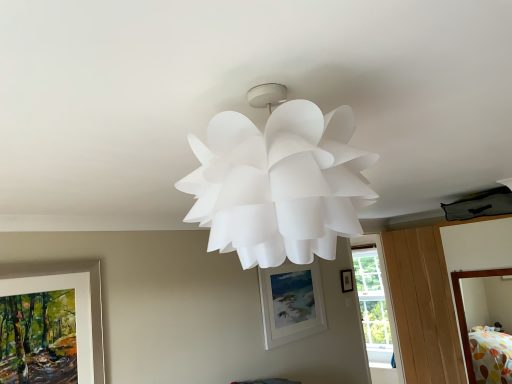
Question: Does matte black picture frame at upper center, which appears as the first picture frame when viewed from the back, have a larger size compared to white matte picture frame at center, the 2th picture frame in the front-to-back sequence?

Choices:
 (A) yes
 (B) no

Answer: (B)

Question: From a real-world perspective, is matte black picture frame at upper center, which is the 1th picture frame in right-to-left order, on top of white matte picture frame at center, the 2th picture frame in the front-to-back sequence?

Choices:
 (A) yes
 (B) no

Answer: (A)

Question: From the image's perspective, does matte black picture frame at upper center, positioned as the 3th picture frame in left-to-right order, appear lower than white matte picture frame at center, arranged as the 2th picture frame when viewed from the right?

Choices:
 (A) yes
 (B) no

Answer: (B)

Question: Does matte black picture frame at upper center, which appears as the first picture frame when viewed from the back, have a lesser width compared to white matte picture frame at center, which appears as the 2th picture frame when viewed from the back?

Choices:
 (A) no
 (B) yes

Answer: (B)

Question: Considering the relative sizes of matte black picture frame at upper center, the 3th picture frame viewed from the front, and white matte picture frame at center, which appears as the 2th picture frame when viewed from the back, in the image provided, is matte black picture frame at upper center, the 3th picture frame viewed from the front, wider than white matte picture frame at center, which appears as the 2th picture frame when viewed from the back,?

Choices:
 (A) yes
 (B) no

Answer: (B)

Question: Is the depth of matte black picture frame at upper center, which appears as the first picture frame when viewed from the back, greater than that of white matte picture frame at center, the second picture frame viewed from the left?

Choices:
 (A) no
 (B) yes

Answer: (B)

Question: Is matte black picture frame at upper center, which is the 1th picture frame in right-to-left order, completely or partially inside polka dot fabric bed at lower right?

Choices:
 (A) yes
 (B) no

Answer: (B)

Question: From the image's perspective, is polka dot fabric bed at lower right beneath matte black picture frame at upper center, positioned as the 3th picture frame in left-to-right order?

Choices:
 (A) no
 (B) yes

Answer: (B)

Question: From a real-world perspective, is polka dot fabric bed at lower right located higher than matte black picture frame at upper center, the 3th picture frame viewed from the front?

Choices:
 (A) no
 (B) yes

Answer: (A)

Question: Could you tell me if polka dot fabric bed at lower right is facing matte black picture frame at upper center, which appears as the first picture frame when viewed from the back?

Choices:
 (A) yes
 (B) no

Answer: (B)

Question: Is polka dot fabric bed at lower right positioned behind matte black picture frame at upper center, the 3th picture frame viewed from the front?

Choices:
 (A) no
 (B) yes

Answer: (A)

Question: Does polka dot fabric bed at lower right have a lesser width compared to matte black picture frame at upper center, positioned as the 3th picture frame in left-to-right order?

Choices:
 (A) no
 (B) yes

Answer: (A)

Question: Can transparent glass window at center be found inside matte black picture frame at upper center, which appears as the first picture frame when viewed from the back?

Choices:
 (A) no
 (B) yes

Answer: (A)